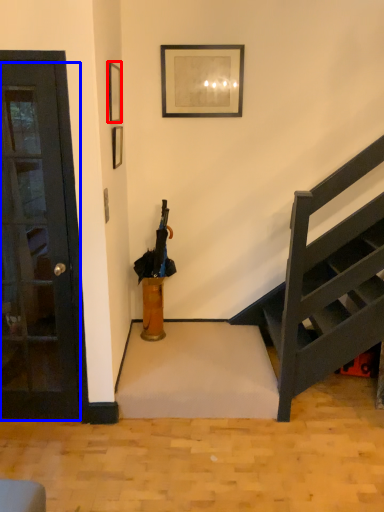
Question: Which object is closer to the camera taking this photo, picture frame (highlighted by a red box) or door (highlighted by a blue box)?

Choices:
 (A) picture frame
 (B) door

Answer: (B)